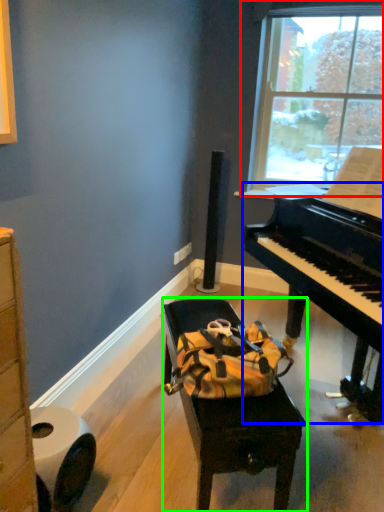
Question: Which object is positioned farthest from window (highlighted by a red box)? Select from piano (highlighted by a blue box) and furniture (highlighted by a green box).

Choices:
 (A) piano
 (B) furniture

Answer: (B)